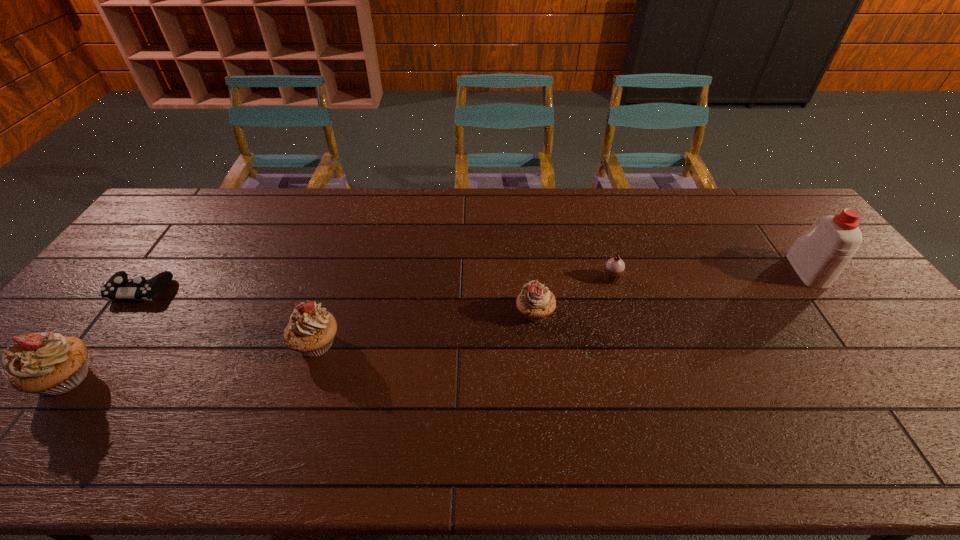
The image size is (960, 540). I want to click on vacant space located 0.260m on the back of the leftmost cupcake, so click(x=142, y=280).

The image size is (960, 540). I want to click on blank space located on the right of the third shortest cupcake, so [x=475, y=343].

Identify the location of free space located 0.260m on the left of the third cupcake from left to right. The width and height of the screenshot is (960, 540). (420, 313).

At what (x,y) coordinates should I click in order to perform the action: click on free space located 0.200m on the surface of the shortest object. Please return your answer as a coordinate pair (x, y). The image size is (960, 540). Looking at the image, I should click on (84, 364).

Where is `blank space located 0.250m on the handle side of the detergent`? This screenshot has height=540, width=960. blank space located 0.250m on the handle side of the detergent is located at coordinates (759, 207).

Locate an element on the screen. Image resolution: width=960 pixels, height=540 pixels. vacant space situated on the handle side of the detergent is located at coordinates (780, 236).

This screenshot has width=960, height=540. What are the coordinates of `free space located 0.350m on the handle side of the detergent` in the screenshot? It's located at (747, 191).

At what (x,y) coordinates should I click in order to perform the action: click on free space located 0.380m on the front of the fifth object from left to right. Please return your answer as a coordinate pair (x, y). Image resolution: width=960 pixels, height=540 pixels. Looking at the image, I should click on (649, 404).

Find the location of a particular element. object located in the near edge section of the desktop is located at coordinates (50, 364).

The height and width of the screenshot is (540, 960). Identify the location of cupcake present at the left edge. (50, 364).